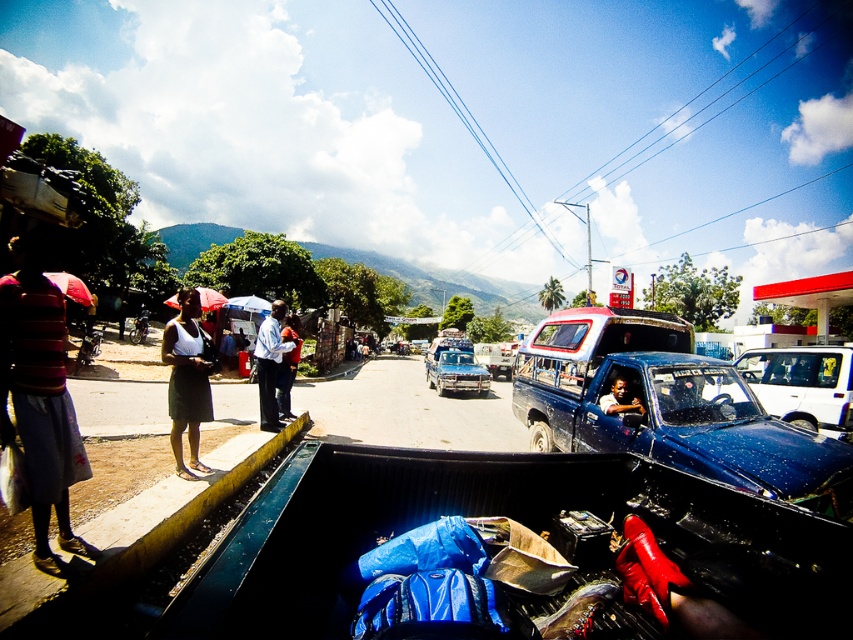
Question: Which point is farther to the camera?

Choices:
 (A) blue matte pickup truck at center
 (B) white matte dress at lower left

Answer: (B)

Question: Is white matte dress at lower left wider than matte blue truck at center?

Choices:
 (A) yes
 (B) no

Answer: (A)

Question: Which point is closer to the camera?

Choices:
 (A) matte blue truck at center
 (B) light blue shirt at center

Answer: (A)

Question: Which point appears farthest from the camera in this image?

Choices:
 (A) (184, 417)
 (B) (628, 385)
 (C) (663, 346)

Answer: (C)

Question: Does white matte dress at lower left appear over dark blue shirt at center?

Choices:
 (A) yes
 (B) no

Answer: (A)

Question: Does light blue shirt at center have a greater width compared to shiny blue truck at center?

Choices:
 (A) yes
 (B) no

Answer: (B)